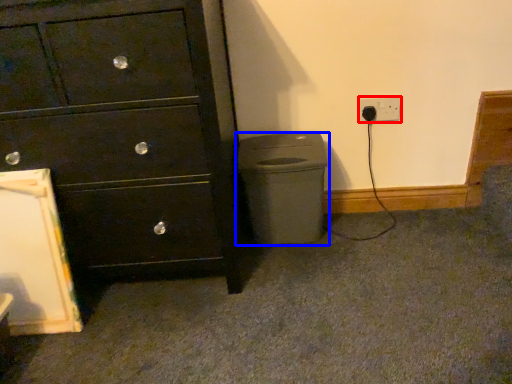
Question: Which object appears farthest to the camera in this image, power plugs and sockets (highlighted by a red box) or waste container (highlighted by a blue box)?

Choices:
 (A) power plugs and sockets
 (B) waste container

Answer: (A)